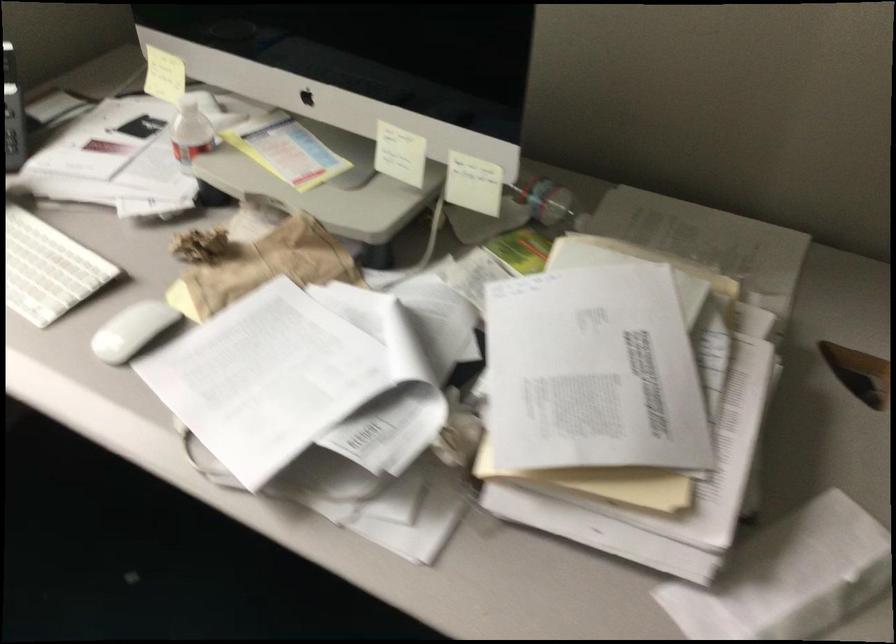
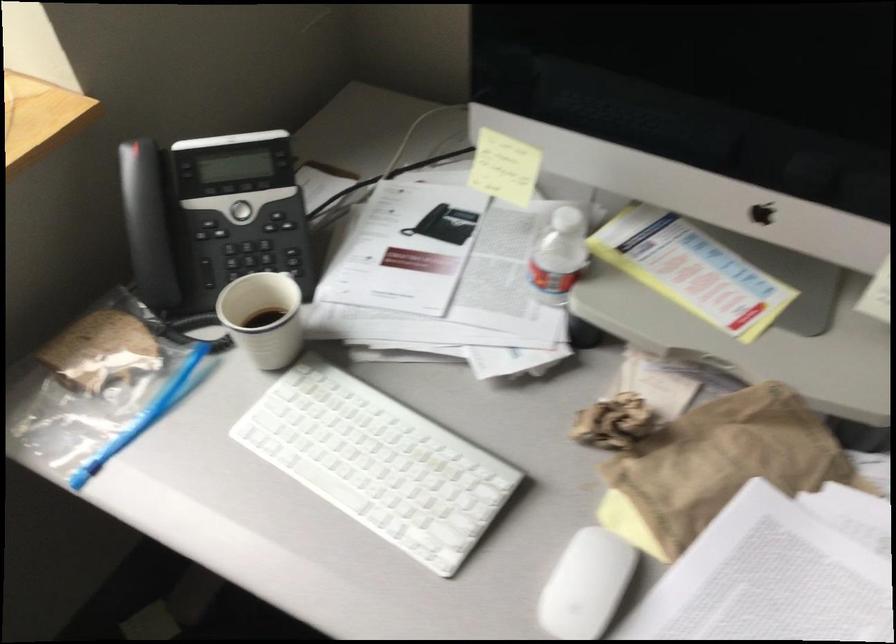
The point at (188, 131) is marked in the first image. Where is the corresponding point in the second image?

(558, 254)